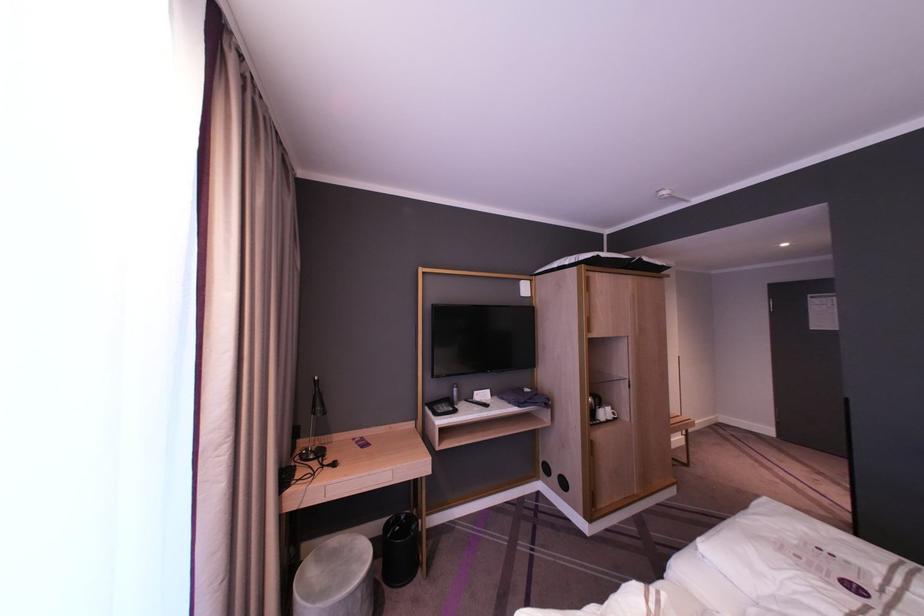
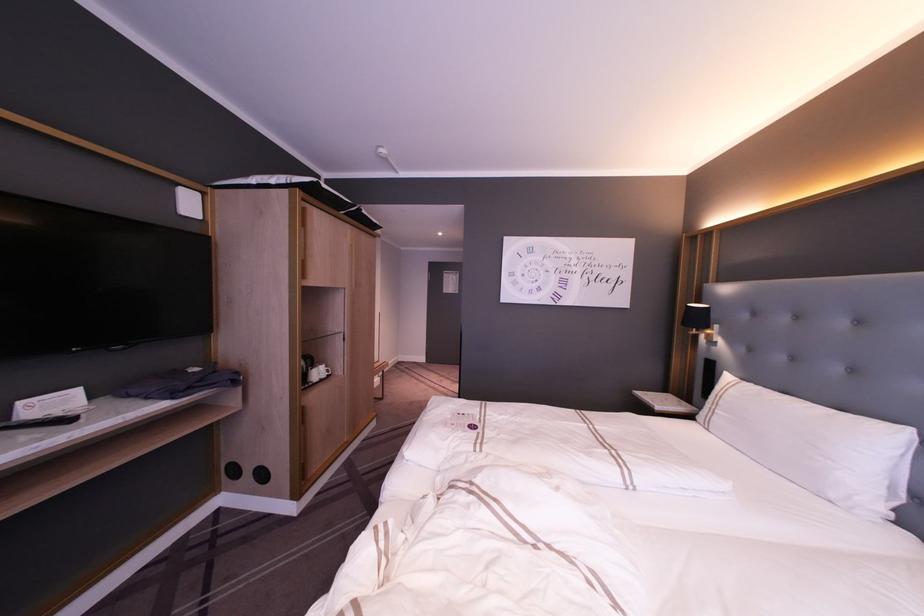
Locate, in the second image, the point that corresponds to point (599, 400) in the first image.

(310, 362)